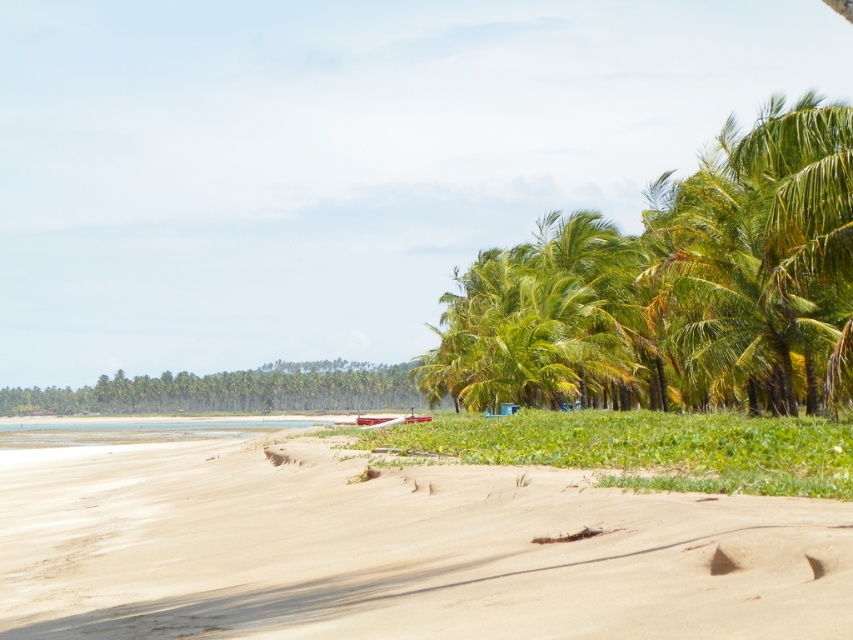
Question: Can you confirm if sandy beach at lower left is wider than green leafy coconut trees at right?

Choices:
 (A) no
 (B) yes

Answer: (B)

Question: Can you confirm if sandy beach at lower left is smaller than green leafy coconut trees at right?

Choices:
 (A) yes
 (B) no

Answer: (A)

Question: Does sandy beach at lower left lie in front of green leafy coconut trees at right?

Choices:
 (A) yes
 (B) no

Answer: (A)

Question: Which object appears closest to the camera in this image?

Choices:
 (A) sandy beach at lower left
 (B) green leafy coconut trees at right

Answer: (A)

Question: Among these objects, which one is farthest from the camera?

Choices:
 (A) green leafy coconut trees at right
 (B) sandy beach at lower left

Answer: (A)